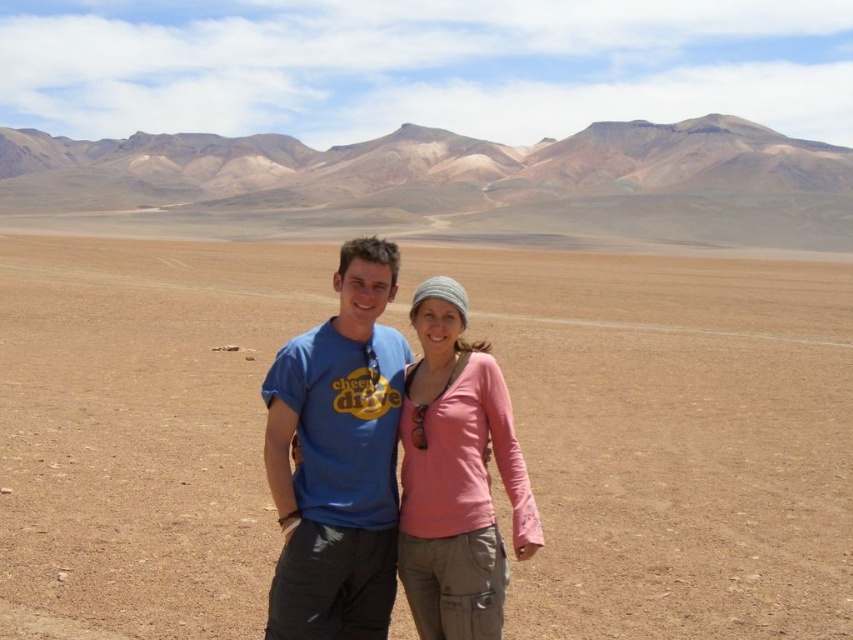
Can you confirm if brown sandy dirt at center is smaller than dull brown rock at upper center?

Correct, brown sandy dirt at center occupies less space than dull brown rock at upper center.

Which is below, brown sandy dirt at center or dull brown rock at upper center?

Positioned lower is brown sandy dirt at center.

Image resolution: width=853 pixels, height=640 pixels. What are the coordinates of `brown sandy dirt at center` in the screenshot? It's located at (672, 438).

Can you confirm if dull brown rock at upper center is wider than pink fabric shirt at center?

Correct, the width of dull brown rock at upper center exceeds that of pink fabric shirt at center.

Which is more to the left, dull brown rock at upper center or pink fabric shirt at center?

dull brown rock at upper center is more to the left.

Is point (457, 163) positioned in front of point (434, 520)?

No, (457, 163) is further to viewer.

At what (x,y) coordinates should I click in order to perform the action: click on dull brown rock at upper center. Please return your answer as a coordinate pair (x, y). Looking at the image, I should click on tap(465, 179).

What do you see at coordinates (337, 458) in the screenshot? I see `blue t-shirt at center` at bounding box center [337, 458].

Does point (389, 525) lie behind point (410, 460)?

No, it is not.

Where is `blue t-shirt at center`? The image size is (853, 640). blue t-shirt at center is located at coordinates (337, 458).